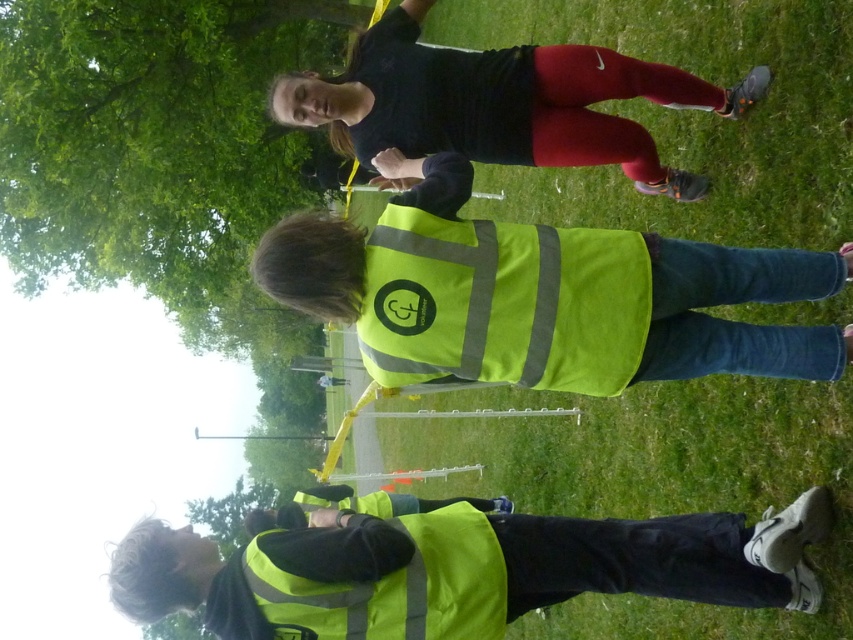
Question: Among these points, which one is nearest to the camera?

Choices:
 (A) (244, 109)
 (B) (115, 570)
 (C) (422, 547)
 (D) (642, 365)

Answer: (D)

Question: Estimate the real-world distances between objects in this image. Which object is farther from the high visibility vest at lower center?

Choices:
 (A) high-visibility fabric safety vest at lower center
 (B) neon yellow reflective vest at center
 (C) matte black shirt at upper center

Answer: (C)

Question: Observing the image, what is the correct spatial positioning of high visibility vest at lower center in reference to high-visibility fabric safety vest at lower center?

Choices:
 (A) above
 (B) below

Answer: (B)

Question: Which point is closer to the camera?

Choices:
 (A) matte black shirt at upper center
 (B) green leafy tree at upper left
 (C) high visibility vest at lower center

Answer: (C)

Question: Is green leafy tree at upper left closer to the viewer compared to neon yellow reflective vest at center?

Choices:
 (A) yes
 (B) no

Answer: (B)

Question: In this image, where is neon yellow reflective vest at center located relative to high visibility vest at lower center?

Choices:
 (A) above
 (B) below

Answer: (A)